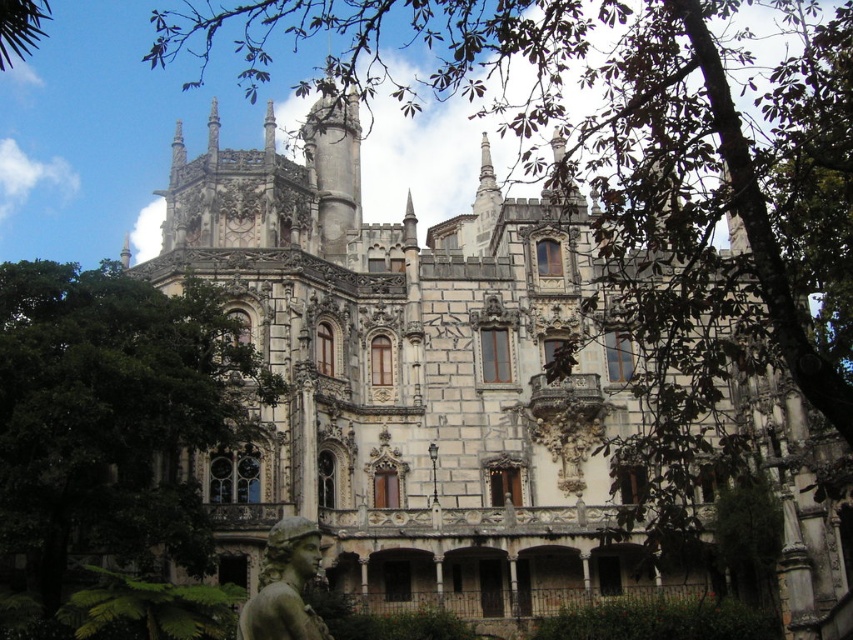
Question: Does green leafy tree at center have a larger size compared to green marble statue at lower center?

Choices:
 (A) yes
 (B) no

Answer: (A)

Question: Is green leafy tree at center below green marble statue at lower center?

Choices:
 (A) yes
 (B) no

Answer: (B)

Question: Is green leafy tree at center further to camera compared to green marble statue at lower center?

Choices:
 (A) yes
 (B) no

Answer: (A)

Question: Which of the following is the farthest from the observer?

Choices:
 (A) green marble statue at lower center
 (B) green leafy tree at center

Answer: (B)